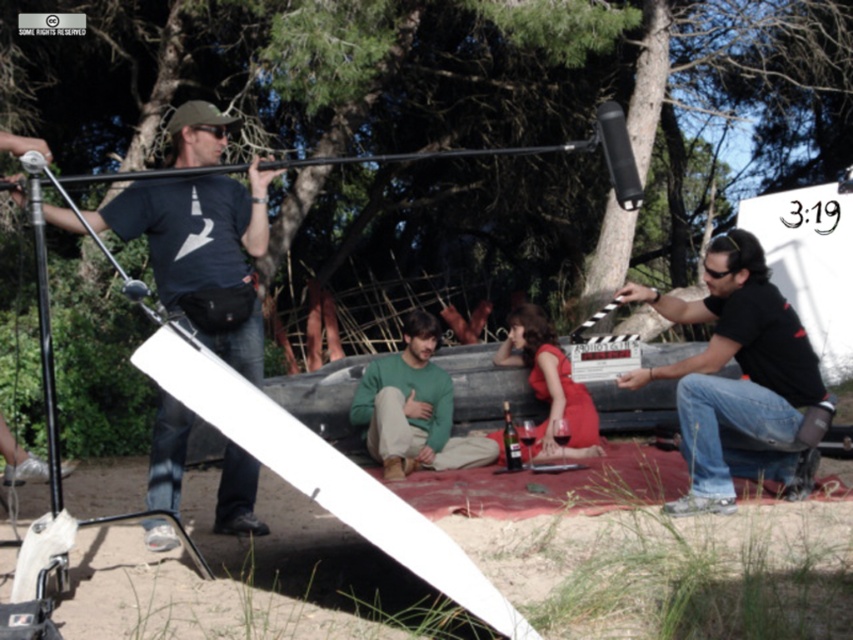
You are a GUI agent. You are given a task and a screenshot of the screen. Output one action in this format:
    pyautogui.click(x=<x>, y=<y>)
    Task: Click on the green matte sweater at center
    The image size is (853, 640).
    Given the screenshot: What is the action you would take?
    pyautogui.click(x=413, y=408)

Describe the element at coordinates (413, 408) in the screenshot. The height and width of the screenshot is (640, 853). I see `green matte sweater at center` at that location.

Is point (465, 444) in front of point (585, 445)?

Yes, it is in front of point (585, 445).

The image size is (853, 640). Find the location of `green matte sweater at center`. green matte sweater at center is located at coordinates (413, 408).

Does black matte shirt at right have a smaller size compared to matte red dress at center?

Incorrect, black matte shirt at right is not smaller in size than matte red dress at center.

Which is above, black matte shirt at right or matte red dress at center?

black matte shirt at right

Does point (780, 394) come closer to viewer compared to point (544, 392)?

Yes, it is.

Identify the location of black matte shirt at right. (735, 380).

Is matte black t-shirt at left thinner than green matte sweater at center?

Correct, matte black t-shirt at left's width is less than green matte sweater at center's.

Does point (254, 298) lie in front of point (410, 412)?

Yes.

Where is `matte black t-shirt at left`? The image size is (853, 640). matte black t-shirt at left is located at coordinates (202, 253).